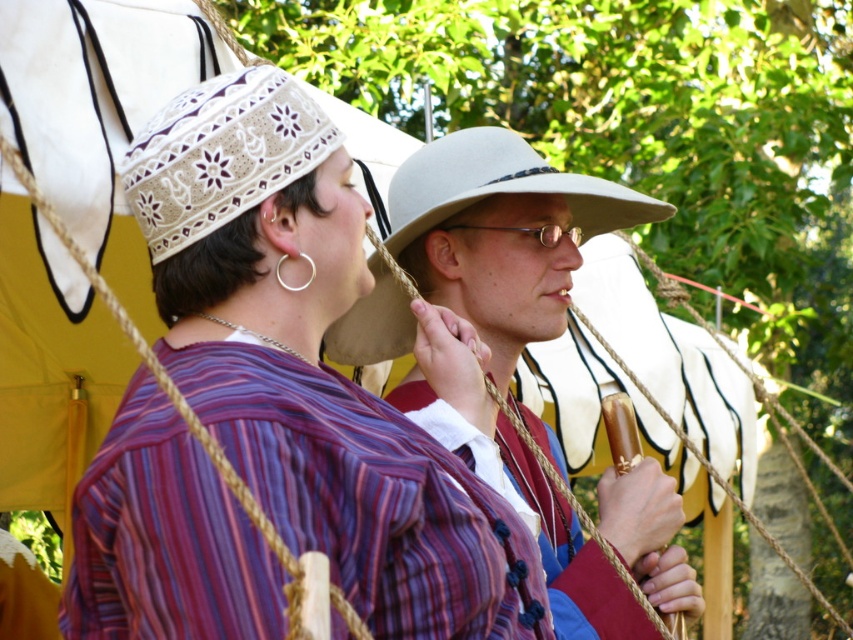
Who is shorter, matte white hat at center or white lace cowboy hat at upper center?

With less height is white lace cowboy hat at upper center.

Does matte white hat at center lie behind white lace cowboy hat at upper center?

Yes, matte white hat at center is behind white lace cowboy hat at upper center.

Is point (567, 580) more distant than point (161, 129)?

Yes, point (567, 580) is behind point (161, 129).

This screenshot has height=640, width=853. In order to click on matte white hat at center in this screenshot , I will do `click(502, 241)`.

Is white lace cowboy hat at upper center wider than beige felt cowboy hat at center?

Incorrect, white lace cowboy hat at upper center's width does not surpass beige felt cowboy hat at center's.

Is point (329, 125) positioned behind point (447, 198)?

No, (329, 125) is closer to viewer.

I want to click on white lace cowboy hat at upper center, so click(x=221, y=154).

Can you confirm if matte striped shirt at center is positioned below beige felt cowboy hat at center?

Yes.

Does matte striped shirt at center have a larger size compared to beige felt cowboy hat at center?

Correct, matte striped shirt at center is larger in size than beige felt cowboy hat at center.

This screenshot has height=640, width=853. What are the coordinates of `matte striped shirt at center` in the screenshot? It's located at (321, 365).